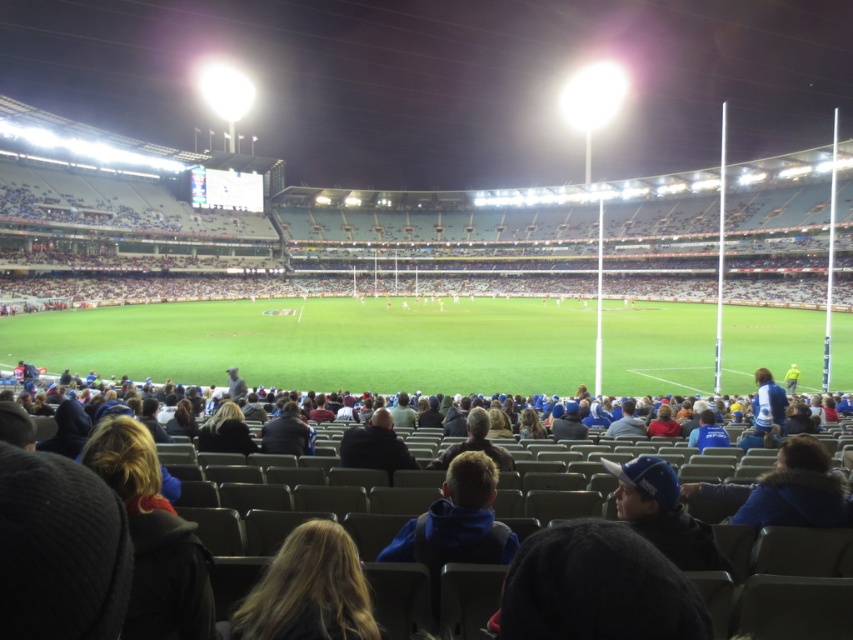
The image size is (853, 640). What do you see at coordinates (231, 545) in the screenshot?
I see `dark blue jacket at center` at bounding box center [231, 545].

Is dark blue jacket at center closer to camera compared to blue fabric cap at center?

Yes.

Is point (286, 513) behind point (659, 465)?

That is True.

Find the location of `dark blue jacket at center`. dark blue jacket at center is located at coordinates (231, 545).

Can you confirm if dark blue jacket at center is positioned below blonde hair at lower center?

No, dark blue jacket at center is not below blonde hair at lower center.

Locate an element on the screen. dark blue jacket at center is located at coordinates (231, 545).

Is dark gray jacket at center below dark brown leather jacket at center?

Yes, dark gray jacket at center is below dark brown leather jacket at center.

Is dark gray jacket at center above dark brown leather jacket at center?

Actually, dark gray jacket at center is below dark brown leather jacket at center.

Where is `dark gray jacket at center`? Image resolution: width=853 pixels, height=640 pixels. dark gray jacket at center is located at coordinates click(x=375, y=445).

Locate an element on the screen. The height and width of the screenshot is (640, 853). dark gray jacket at center is located at coordinates (375, 445).